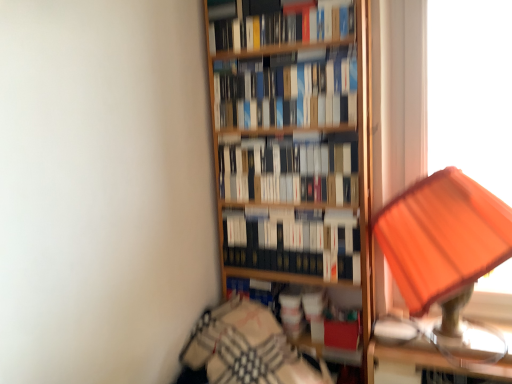
I want to click on free area below hardcover books at upper center, which is the 1th book from top to bottom (from a real-world perspective), so click(280, 52).